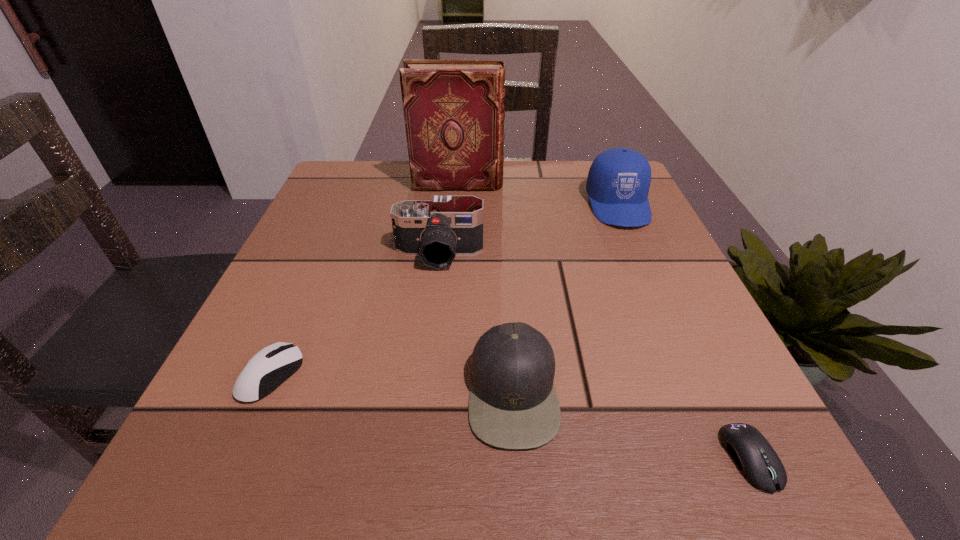
Find the location of a particular element. Image resolution: width=960 pixels, height=540 pixels. vacant space positioned 0.190m on the spine side of the hardback book is located at coordinates (583, 184).

Where is `free space located 0.280m on the front-facing side of the farther cap`? free space located 0.280m on the front-facing side of the farther cap is located at coordinates (674, 332).

This screenshot has height=540, width=960. In order to click on vacant space located on the front-facing side of the camera in this screenshot , I will do `click(434, 302)`.

Image resolution: width=960 pixels, height=540 pixels. Identify the location of vacant space located on the brim of the nearer cap. (284, 392).

The image size is (960, 540). I want to click on free location located 0.340m on the brim of the nearer cap, so click(227, 392).

Where is `vacant space situated on the brim of the nearer cap`? vacant space situated on the brim of the nearer cap is located at coordinates coord(419,392).

Locate an element on the screen. The height and width of the screenshot is (540, 960). blank space located 0.260m on the back of the left computer equipment is located at coordinates (326, 247).

Where is `vacant region located on the left of the shortest object`? vacant region located on the left of the shortest object is located at coordinates (670, 458).

What are the coordinates of `hardback book that is at the far edge` in the screenshot? It's located at (454, 114).

At what (x,y) coordinates should I click in order to perform the action: click on cap present at the far edge. Please return your answer as a coordinate pair (x, y). This screenshot has height=540, width=960. Looking at the image, I should click on (618, 182).